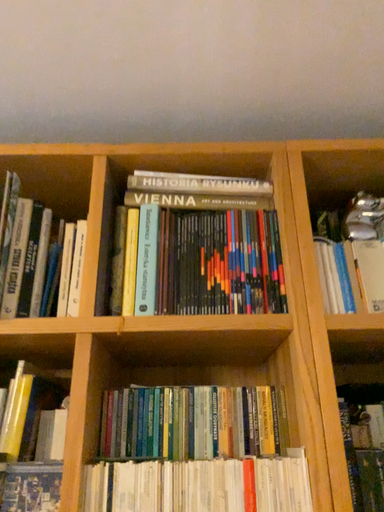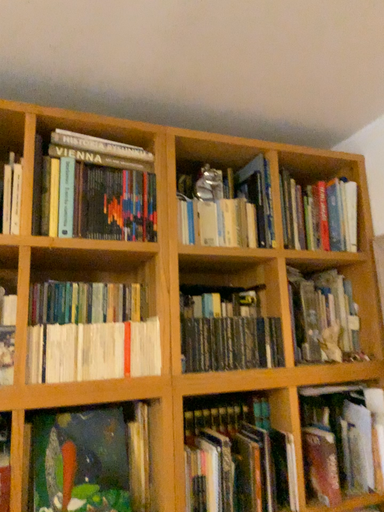
Question: Which way did the camera rotate in the video?

Choices:
 (A) rotated right
 (B) rotated left

Answer: (A)